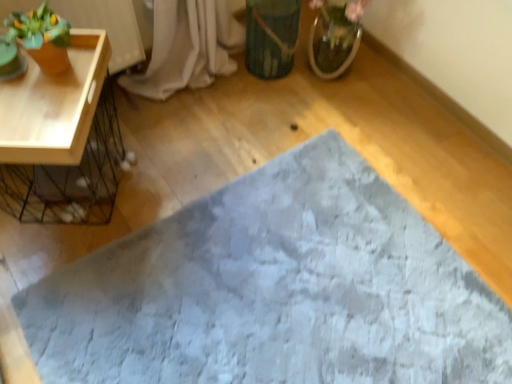
The image size is (512, 384). Identify the location of vacant space that is in between gray textured bath mat at center and green matte vase at center. (253, 145).